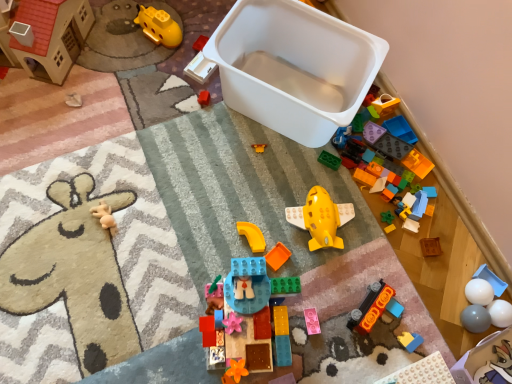
Where is `free space that is in between orange matte car at lower right, the 8th toy in the right-to-left sequence, and orange matte block at center, the 11th toy from the right`? This screenshot has height=384, width=512. free space that is in between orange matte car at lower right, the 8th toy in the right-to-left sequence, and orange matte block at center, the 11th toy from the right is located at coordinates (325, 285).